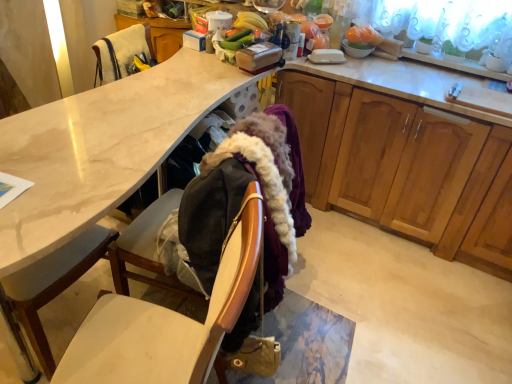
Question: Does velvet-like fabric armchair at upper left appear on the right side of green matte plant at upper right?

Choices:
 (A) no
 (B) yes

Answer: (A)

Question: Is velvet-like fabric armchair at upper left oriented away from green matte plant at upper right?

Choices:
 (A) no
 (B) yes

Answer: (A)

Question: Is velvet-like fabric armchair at upper left next to green matte plant at upper right and touching it?

Choices:
 (A) no
 (B) yes

Answer: (A)

Question: Is green matte plant at upper right inside velvet-like fabric armchair at upper left?

Choices:
 (A) no
 (B) yes

Answer: (A)

Question: Does velvet-like fabric armchair at upper left have a lesser height compared to green matte plant at upper right?

Choices:
 (A) yes
 (B) no

Answer: (B)

Question: Do you think wooden cabinets at right is within matte white desk at center, or outside of it?

Choices:
 (A) inside
 (B) outside

Answer: (B)

Question: Is wooden cabinets at right in front of or behind matte white desk at center in the image?

Choices:
 (A) behind
 (B) front

Answer: (A)

Question: From a real-world perspective, is wooden cabinets at right physically located above or below matte white desk at center?

Choices:
 (A) below
 (B) above

Answer: (B)

Question: In terms of width, does wooden cabinets at right look wider or thinner when compared to matte white desk at center?

Choices:
 (A) thin
 (B) wide

Answer: (B)

Question: From the image's perspective, relative to wooden chair at lower left, is matte white desk at center above or below?

Choices:
 (A) below
 (B) above

Answer: (B)

Question: Based on their sizes in the image, would you say matte white desk at center is bigger or smaller than wooden chair at lower left?

Choices:
 (A) big
 (B) small

Answer: (A)

Question: In terms of height, does matte white desk at center look taller or shorter compared to wooden chair at lower left?

Choices:
 (A) tall
 (B) short

Answer: (B)

Question: Is point (56, 150) positioned closer to the camera than point (167, 326)?

Choices:
 (A) closer
 (B) farther

Answer: (B)

Question: Is white glossy bowl at upper right spatially inside wooden cabinets at right, or outside of it?

Choices:
 (A) outside
 (B) inside

Answer: (A)

Question: From a real-world perspective, relative to wooden cabinets at right, is white glossy bowl at upper right vertically above or below?

Choices:
 (A) below
 (B) above

Answer: (B)